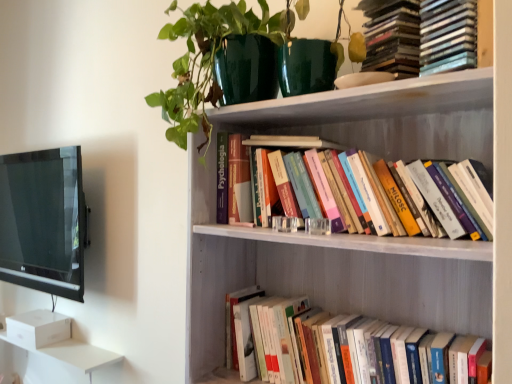
Question: Is point (58, 266) positioned closer to the camera than point (311, 205)?

Choices:
 (A) closer
 (B) farther

Answer: (B)

Question: From the image's perspective, is black glossy tv at left positioned above or below hardcover books at upper center, marked as the second book in a top-to-bottom arrangement?

Choices:
 (A) below
 (B) above

Answer: (A)

Question: Which object is positioned farthest from the hardcover books at upper center, marked as the second book in a top-to-bottom arrangement?

Choices:
 (A) hardcover books at lower right, the 3th book in the top-to-bottom sequence
 (B) black glossy tv at left
 (C) white wooden bookshelf at upper center
 (D) hardcover books at upper right, the third book in the bottom-to-top sequence
 (E) green glossy pot at upper center

Answer: (B)

Question: Which of these objects is positioned farthest from the hardcover books at upper right, placed as the first book when sorted from top to bottom?

Choices:
 (A) hardcover books at upper center, which appears as the 2th book when ordered from the bottom
 (B) hardcover books at lower right, which ranks as the 1th book in bottom-to-top order
 (C) white wooden bookshelf at upper center
 (D) black glossy tv at left
 (E) green glossy pot at upper center

Answer: (D)